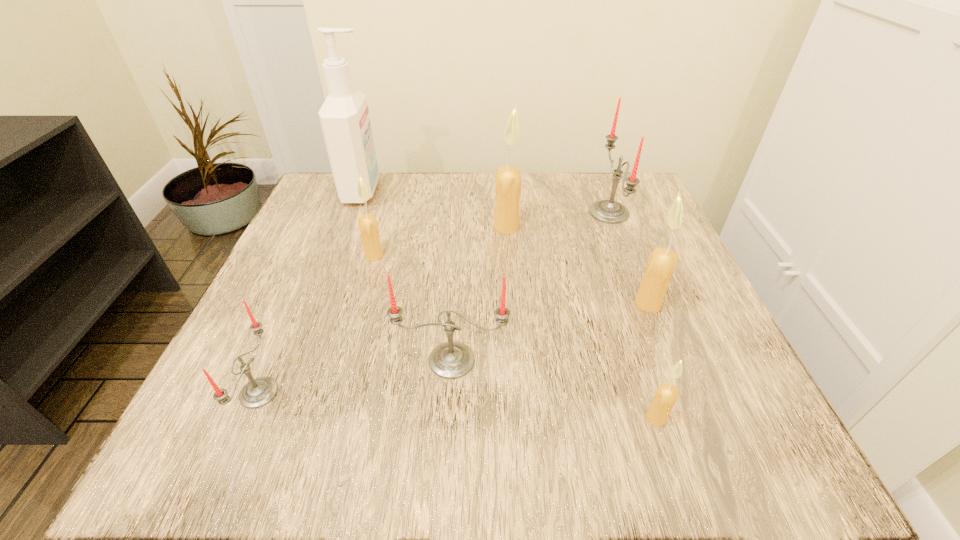
At what (x,y) coordinates should I click in order to perform the action: click on vacant area that lies between the seventh shortest object and the third farthest cream candle. Please return your answer as a coordinate pair (x, y). This screenshot has height=540, width=960. Looking at the image, I should click on (577, 265).

Identify the location of unoccupied position between the seventh shortest object and the fourth nearest candle. (577, 265).

This screenshot has width=960, height=540. I want to click on free area in between the biggest cream candle and the leftmost candle, so click(x=383, y=310).

This screenshot has height=540, width=960. In order to click on free space between the fifth nearest object and the second smallest red candle in this screenshot , I will do `click(413, 308)`.

The image size is (960, 540). What are the coordinates of `free spot between the nearest cream candle and the smallest red candle` in the screenshot? It's located at (457, 406).

Where is `vacant area between the third cream candle from left to right and the second biggest cream candle`? The image size is (960, 540). vacant area between the third cream candle from left to right and the second biggest cream candle is located at coordinates (652, 361).

Where is `free space between the tallest candle and the second candle from left to right`? free space between the tallest candle and the second candle from left to right is located at coordinates (441, 241).

At what (x,y) coordinates should I click in order to perform the action: click on empty location between the fourth nearest candle and the biggest cream candle. Please return your answer as a coordinate pair (x, y). This screenshot has width=960, height=540. Looking at the image, I should click on (577, 265).

At what (x,y) coordinates should I click in order to perform the action: click on free space between the tallest candle and the farthest red candle. Please return your answer as a coordinate pair (x, y). The width and height of the screenshot is (960, 540). Looking at the image, I should click on (558, 220).

Find the location of `object that stands as the second closest to the second red candle from left to right`. object that stands as the second closest to the second red candle from left to right is located at coordinates (667, 394).